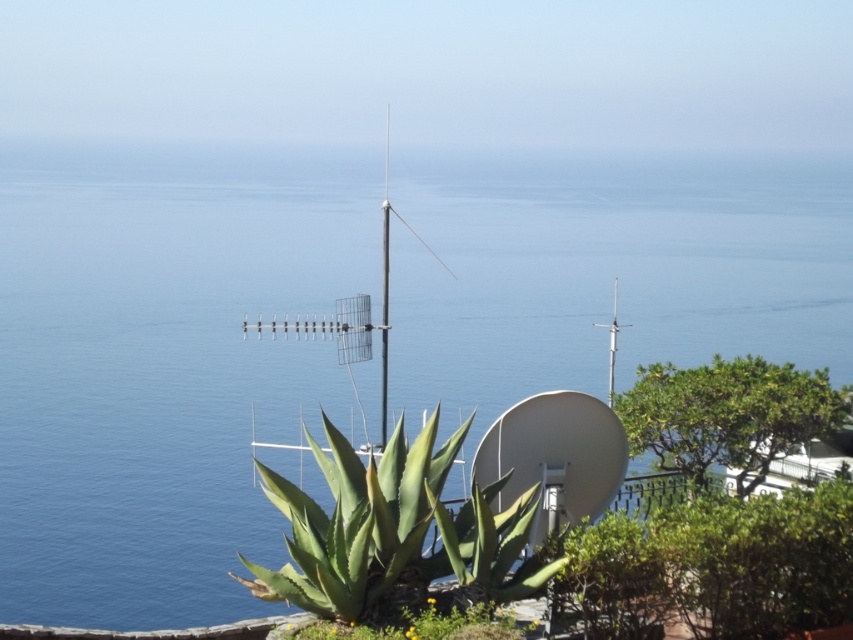
You are standing on the balcony and see the green leafy bush at lower right and the green leafy plant at center. Which one is positioned to the right side of the other?

The green leafy bush at lower right is to the right of the green leafy plant at center.